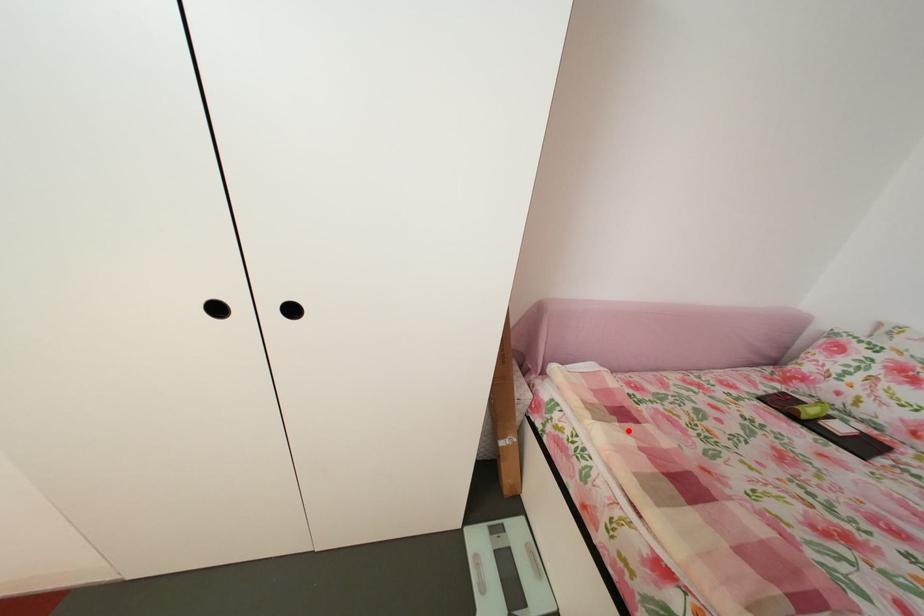
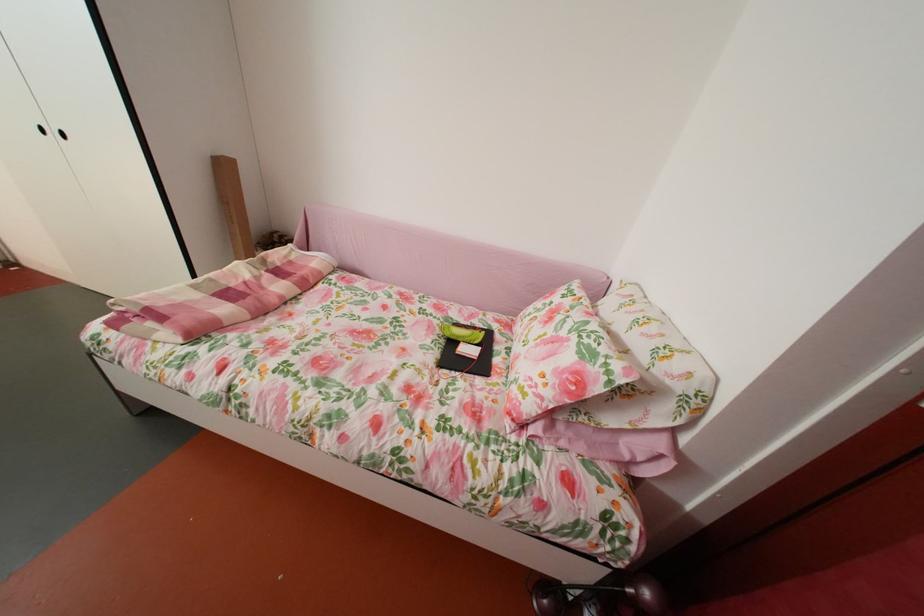
In the second image, find the point that corresponds to the highlighted location in the first image.

(274, 278)